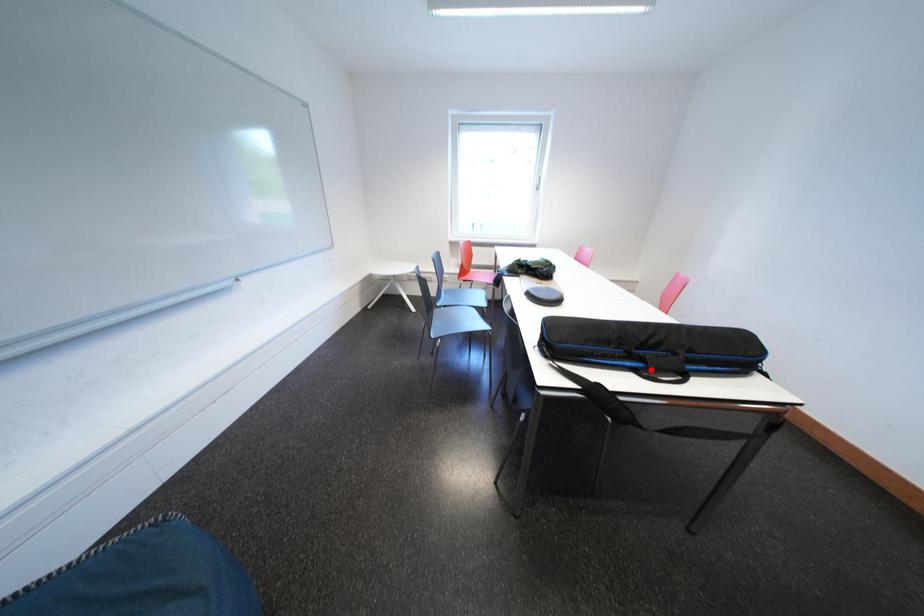
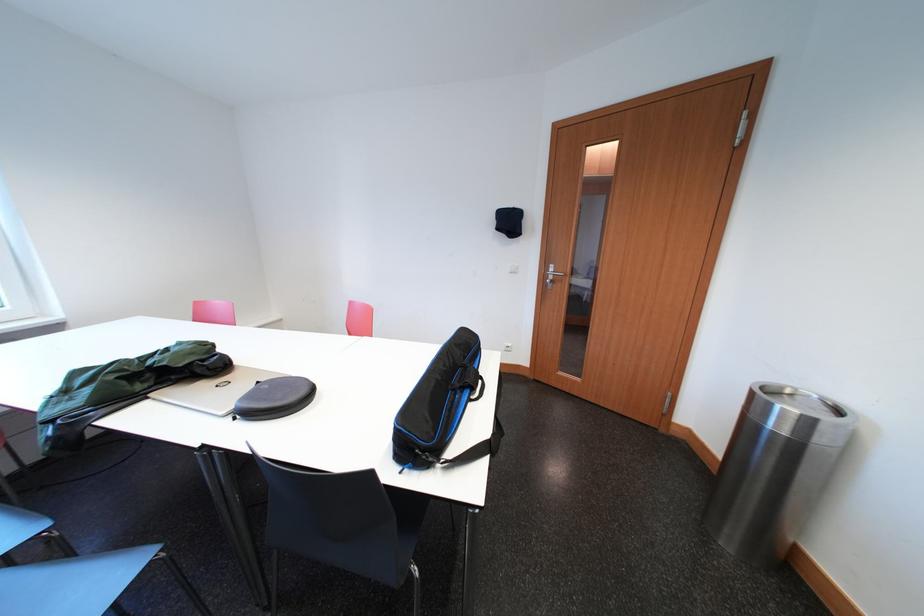
Locate, in the second image, the point that corresponds to the highlighted location in the first image.

(477, 395)